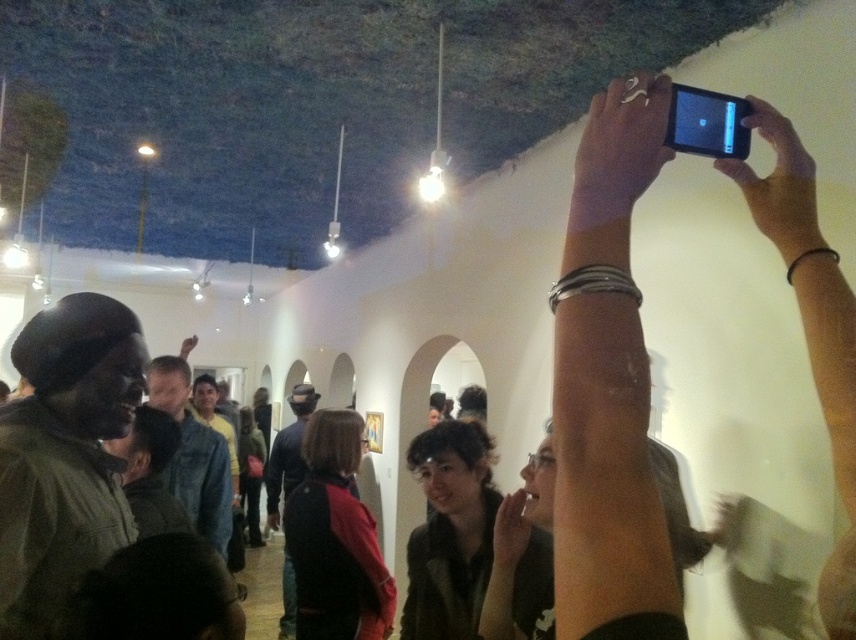
Question: Is smooth skin hand at upper right wider than black matte phone at upper right?

Choices:
 (A) yes
 (B) no

Answer: (A)

Question: Can you confirm if smooth skin hand at upper right is thinner than black matte phone at upper right?

Choices:
 (A) yes
 (B) no

Answer: (B)

Question: Which of the following is the closest to the observer?

Choices:
 (A) 749,188
 (B) 658,113

Answer: (B)

Question: Does smooth skin hand at upper right have a greater width compared to black matte phone at upper right?

Choices:
 (A) yes
 (B) no

Answer: (A)

Question: Among these objects, which one is nearest to the camera?

Choices:
 (A) black matte phone at upper right
 (B) smooth skin hand at upper right

Answer: (B)